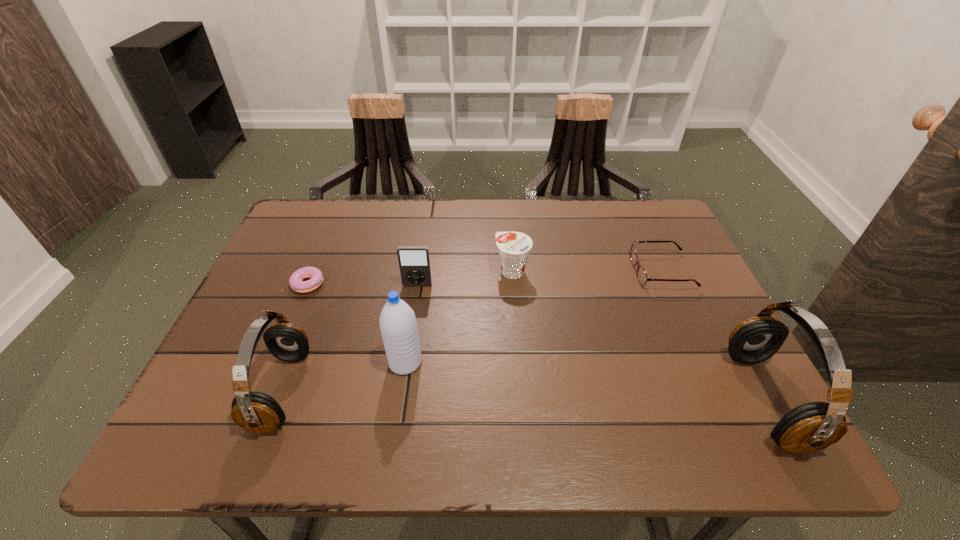
Please point a space for a new headset to maintain equal intervals. Please provide its 2D coordinates. Your answer should be formatted as a tuple, i.e. [(x, y)], where the tuple contains the x and y coordinates of a point satisfying the conditions above.

[(522, 395)]